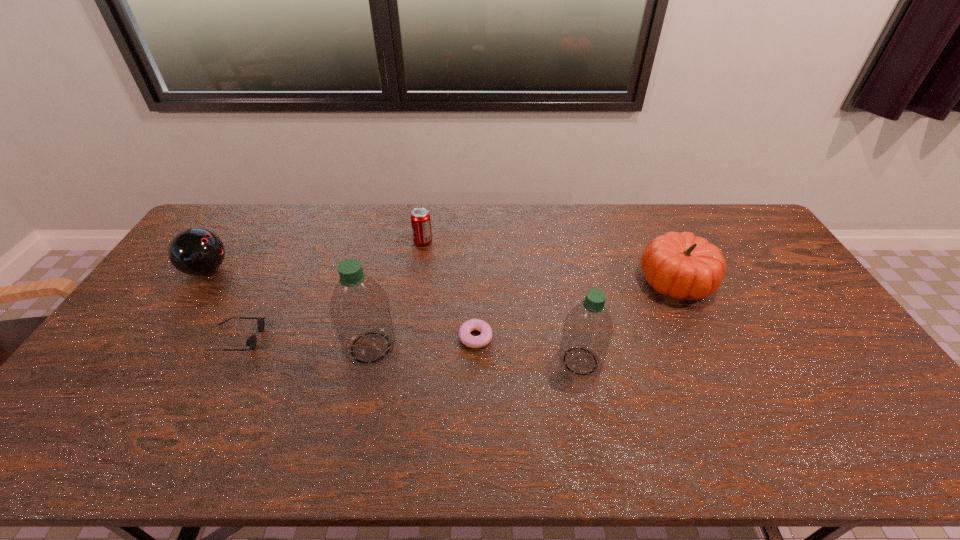
Where is `free location that satisfies the following two spatial constraints: 1. on the surface of the leftmost object near the finger holes; 2. on the left side of the doughnut`? This screenshot has height=540, width=960. free location that satisfies the following two spatial constraints: 1. on the surface of the leftmost object near the finger holes; 2. on the left side of the doughnut is located at coordinates (162, 337).

Locate an element on the screen. Image resolution: width=960 pixels, height=540 pixels. free space that satisfies the following two spatial constraints: 1. on the surface of the shorter water bottle near the finger holes; 2. on the left side of the bowling ball is located at coordinates (146, 361).

I want to click on vacant space that satisfies the following two spatial constraints: 1. on the front-facing side of the second shortest object; 2. on the back side of the tallest object, so 232,348.

The width and height of the screenshot is (960, 540). I want to click on free space in the image that satisfies the following two spatial constraints: 1. on the front side of the third object from right to left; 2. on the front-facing side of the sunglasses, so click(x=475, y=339).

At what (x,y) coordinates should I click in order to perform the action: click on vacant region that satisfies the following two spatial constraints: 1. on the surface of the leftmost object near the finger holes; 2. on the left side of the second object from right to left. Please return your answer as a coordinate pair (x, y). This screenshot has width=960, height=540. Looking at the image, I should click on (146, 361).

Where is `free point that satisfies the following two spatial constraints: 1. on the surface of the leftmost object near the finger holes; 2. on the left side of the second object from right to left`? The image size is (960, 540). free point that satisfies the following two spatial constraints: 1. on the surface of the leftmost object near the finger holes; 2. on the left side of the second object from right to left is located at coordinates (146, 361).

Find the location of `vacant space that satisfies the following two spatial constraints: 1. on the back side of the pumpkin; 2. on the surface of the bowling ball near the finger holes`. vacant space that satisfies the following two spatial constraints: 1. on the back side of the pumpkin; 2. on the surface of the bowling ball near the finger holes is located at coordinates (671, 270).